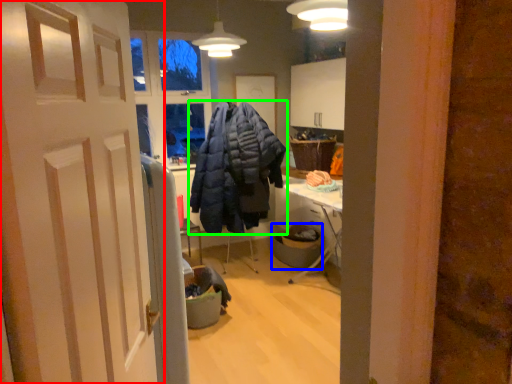
Question: Considering the real-world distances, which object is closest to door (highlighted by a red box)? trash bin/can (highlighted by a blue box) or jacket (highlighted by a green box).

Choices:
 (A) trash bin/can
 (B) jacket

Answer: (B)